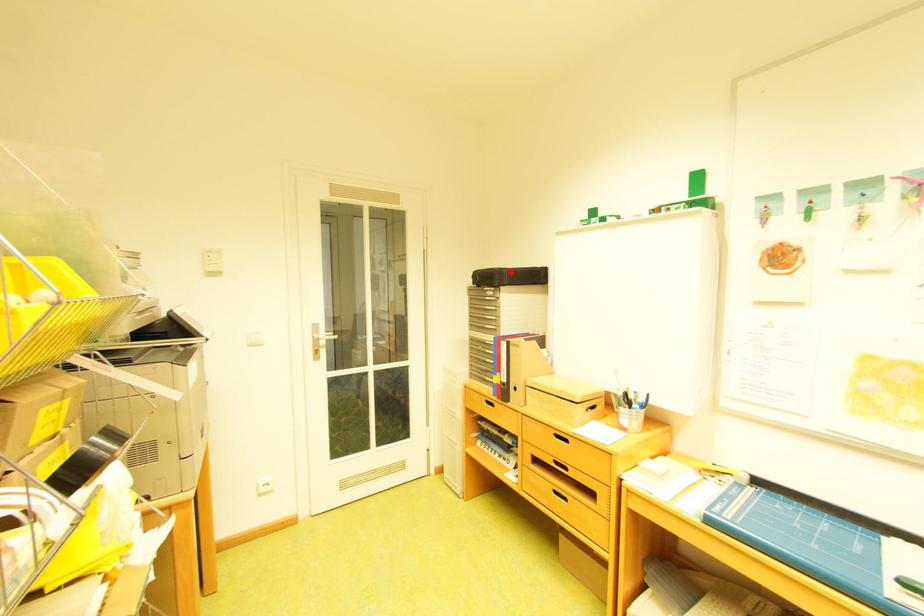
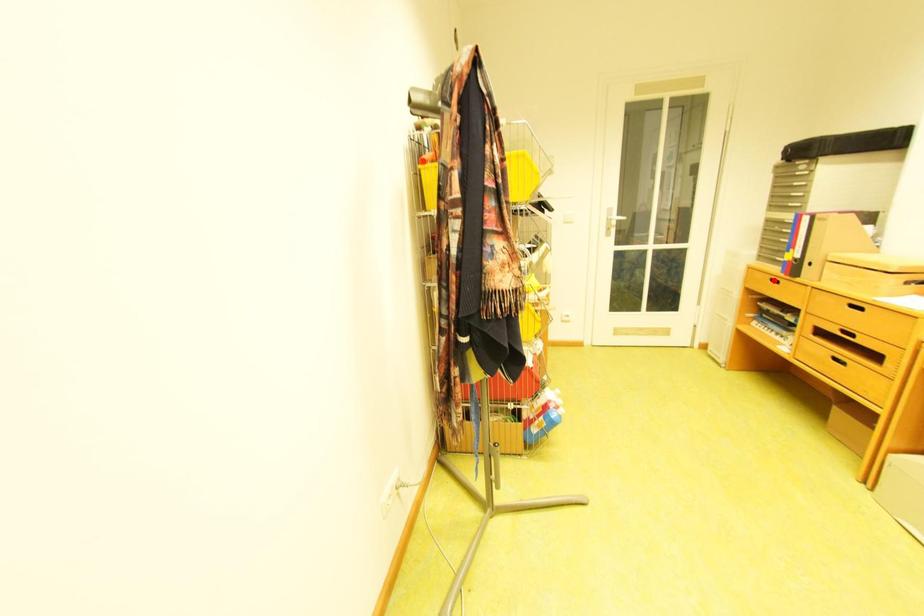
I am providing you with two images of the same scene from different viewpoints. A red point is marked on the first image and another point is marked on the second image. Is the marked point in image1 the same physical position as the marked point in image2?

No